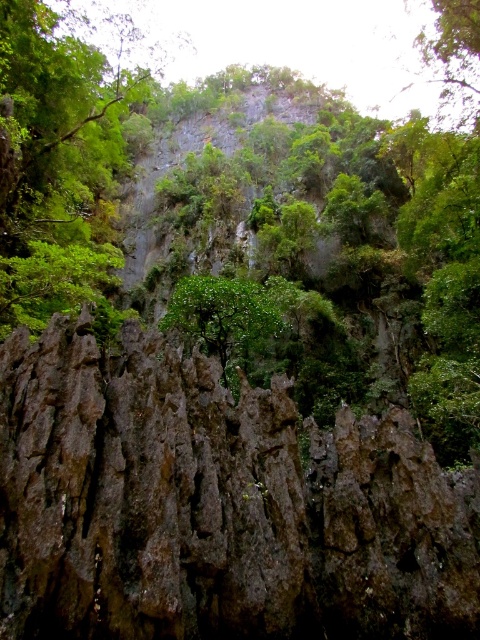
You are standing at the base of the cliff and want to reach the point marked at point (24,560). If your climbing gear can handle a maximum distance of 30 feet from the base, will you be able to reach it?

The distance between you and the point (24,560) is 29.15 feet, which is within your climbing gear limit of 30 feet. Yes, you can reach it.

You are a hiker standing at the base of the cliff and looking up. You notice two green leafy trees on the cliff face. Which tree, the green leafy tree at upper center or the green leafy tree at center, is closer to the top of the cliff?

The green leafy tree at upper center is closer to the top of the cliff because it is taller than the green leafy tree at center.

You are a hiker planning to climb the dark brown rocky cliff at center and the green leafy tree at upper center. Which one has a larger base width?

The dark brown rocky cliff at center might be wider than green leafy tree at upper center, so it likely has a larger base width.